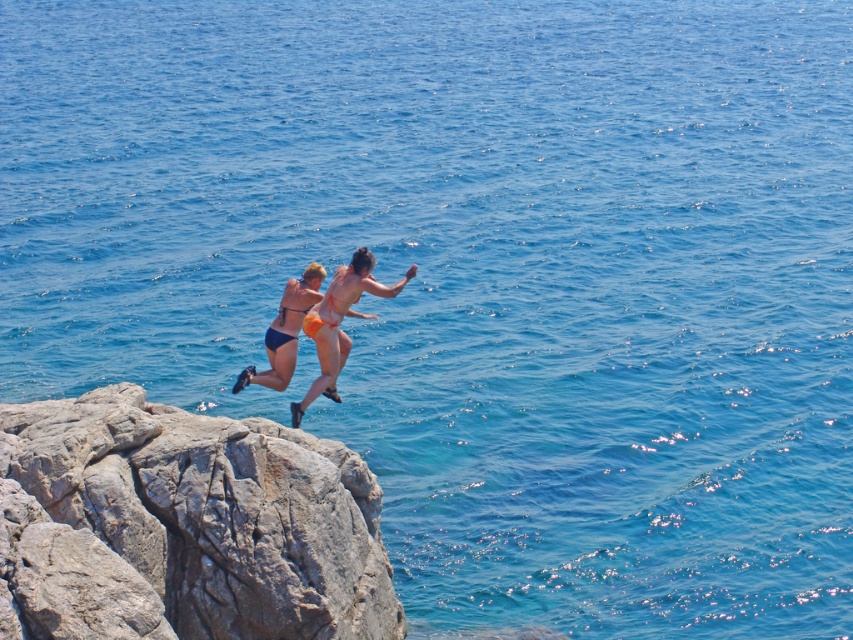
You are a photographer observing two people jumping into water. You notice an orange bikini at center and a matte blue bikini at center. Which one is positioned to the right?

The orange bikini at center is positioned to the right of the matte blue bikini at center.

You are a drone operator trying to capture the best aerial shot of the cliff jumpers. The gray rough rock at left is represented by point (183, 525). Where should you position your drone to ensure the gray rough rock at left is centered in the frame?

To center the gray rough rock at left in the frame, position the drone so that the point (183, 525) is at the center of the camera view.